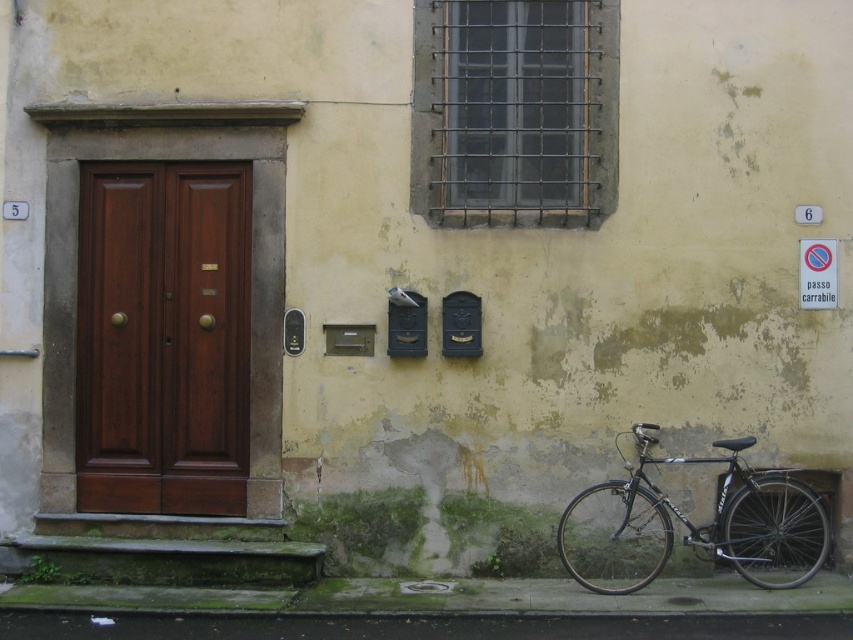
Is shiny black bike at lower right smaller than blue plastic sign at upper right?

No.

Measure the distance between point (616,563) and camera.

26.62 feet

Where is `shiny black bike at lower right`? The height and width of the screenshot is (640, 853). shiny black bike at lower right is located at coordinates (701, 525).

Does mahogany wood door at left have a lesser width compared to shiny black bike at lower right?

Indeed, mahogany wood door at left has a lesser width compared to shiny black bike at lower right.

Is mahogany wood door at left above shiny black bike at lower right?

Yes, mahogany wood door at left is above shiny black bike at lower right.

Which is in front, point (131, 195) or point (660, 458)?

Point (660, 458)

Identify the location of mahogany wood door at left. This screenshot has width=853, height=640. (161, 339).

Between mahogany wood door at left and blue plastic sign at upper right, which one appears on the right side from the viewer's perspective?

From the viewer's perspective, blue plastic sign at upper right appears more on the right side.

Where is `mahogany wood door at left`? Image resolution: width=853 pixels, height=640 pixels. mahogany wood door at left is located at coordinates (161, 339).